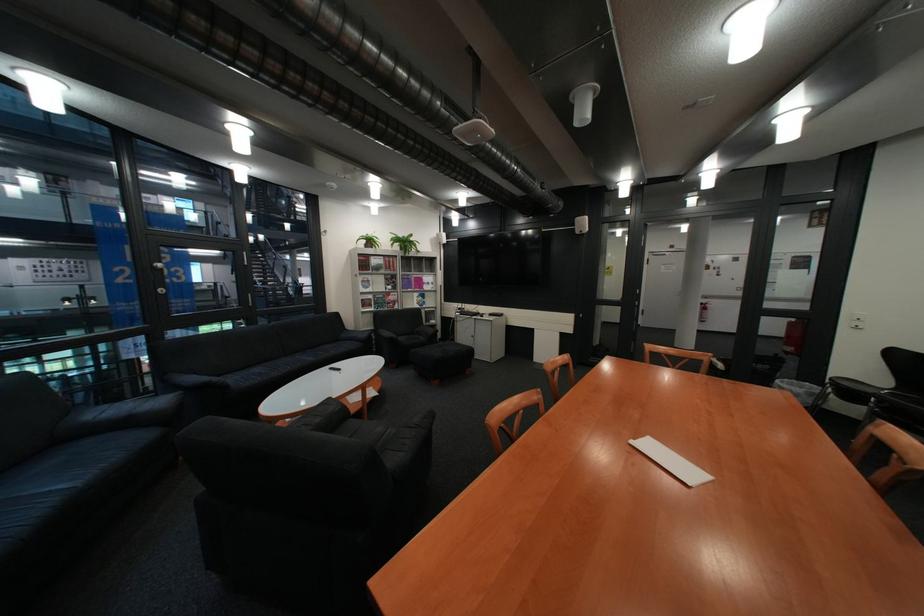
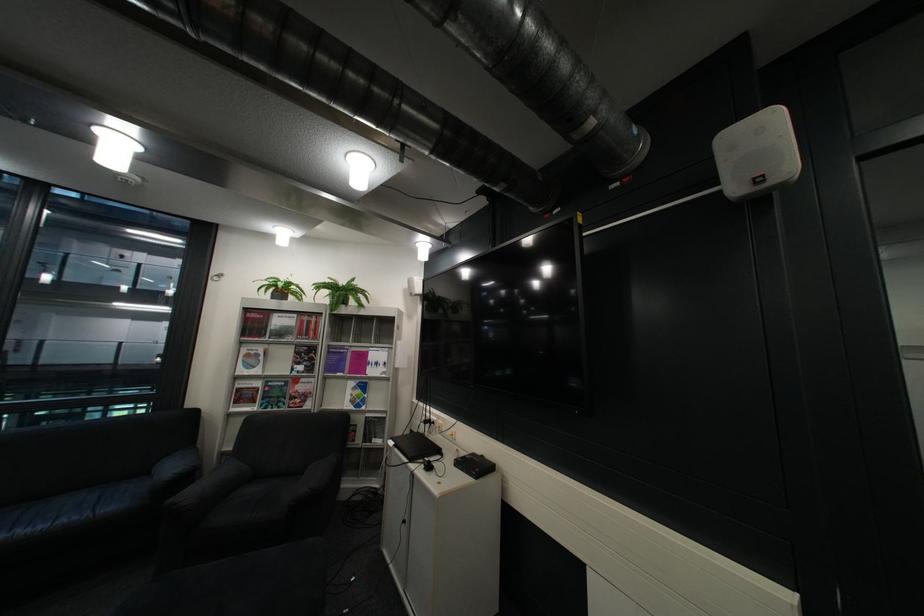
Locate, in the second image, the point that corresponds to point (447, 322) in the first image.

(393, 442)